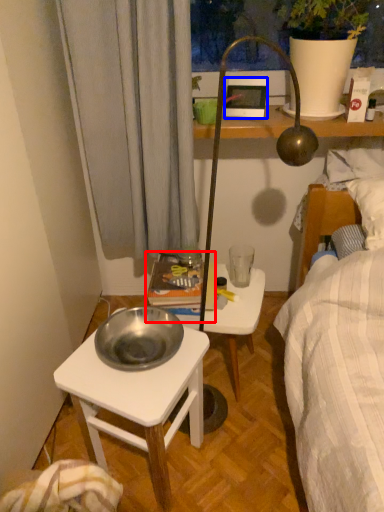
Question: Which object appears farthest to the camera in this image, book (highlighted by a red box) or picture frame (highlighted by a blue box)?

Choices:
 (A) book
 (B) picture frame

Answer: (B)